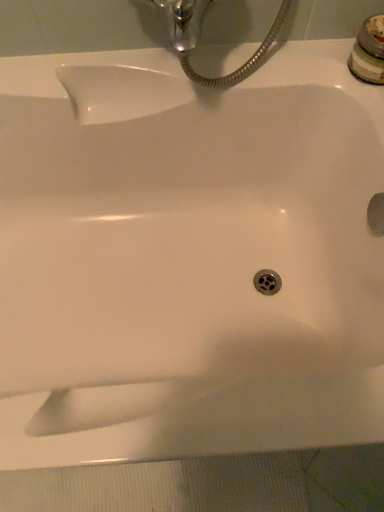
The image size is (384, 512). Describe the element at coordinates (369, 51) in the screenshot. I see `chrome metallic faucet at upper right` at that location.

Locate an element on the screen. Image resolution: width=384 pixels, height=512 pixels. chrome metallic faucet at upper right is located at coordinates pos(369,51).

The width and height of the screenshot is (384, 512). Identify the location of chrome metallic faucet at upper right. (x=369, y=51).